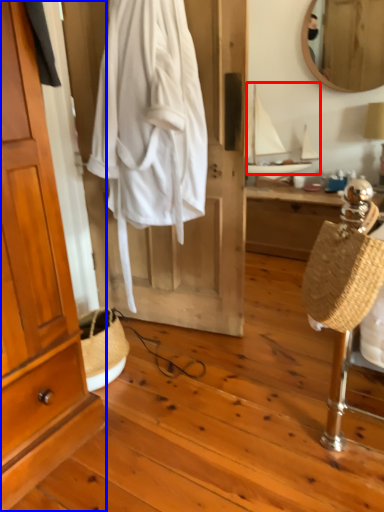
Question: Among these objects, which one is farthest to the camera, sailboat (highlighted by a red box) or cabinetry (highlighted by a blue box)?

Choices:
 (A) sailboat
 (B) cabinetry

Answer: (A)